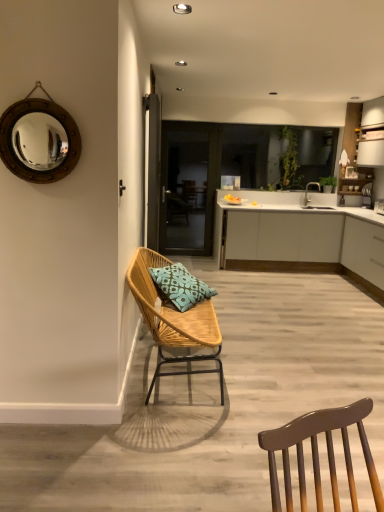
The image size is (384, 512). I want to click on empty space that is to the right of woven wood chair with blue patterned cushion at left, so click(x=283, y=366).